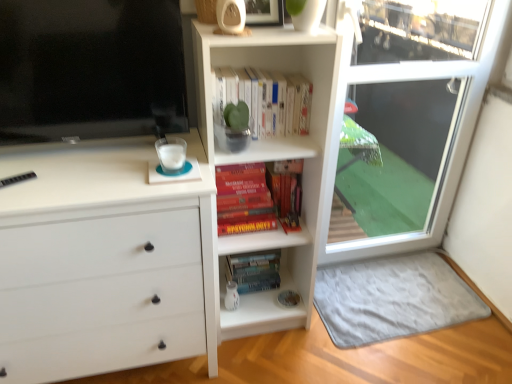
Question: From a real-world perspective, is gray soft rug at lower right positioned above or below hardcover books at center, the second book viewed from the top?

Choices:
 (A) above
 (B) below

Answer: (B)

Question: Which is correct: gray soft rug at lower right is inside hardcover books at center, acting as the first book starting from the bottom, or outside of it?

Choices:
 (A) outside
 (B) inside

Answer: (A)

Question: Which of these objects is positioned farthest from the white matte chest of drawers at left?

Choices:
 (A) hardcover book at center
 (B) flat screen tv at upper left
 (C) transparent glass screen door at right
 (D) hardcover books at center, the second book viewed from the top
 (E) white matte book at upper center, which ranks as the 1th book in top-to-bottom order

Answer: (C)

Question: Estimate the real-world distances between objects in this image. Which object is closer to the transparent glass screen door at right?

Choices:
 (A) hardcover book at center
 (B) hardcover books at center, the second book viewed from the top
 (C) white matte book at upper center, which ranks as the 1th book in top-to-bottom order
 (D) gray soft rug at lower right
 (E) white matte chest of drawers at left

Answer: (D)